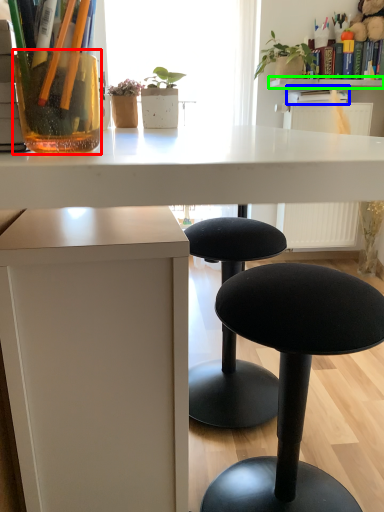
Question: Considering the real-world distances, which object is closest to vase (highlighted by a red box)? book (highlighted by a blue box) or window sill (highlighted by a green box).

Choices:
 (A) book
 (B) window sill

Answer: (A)